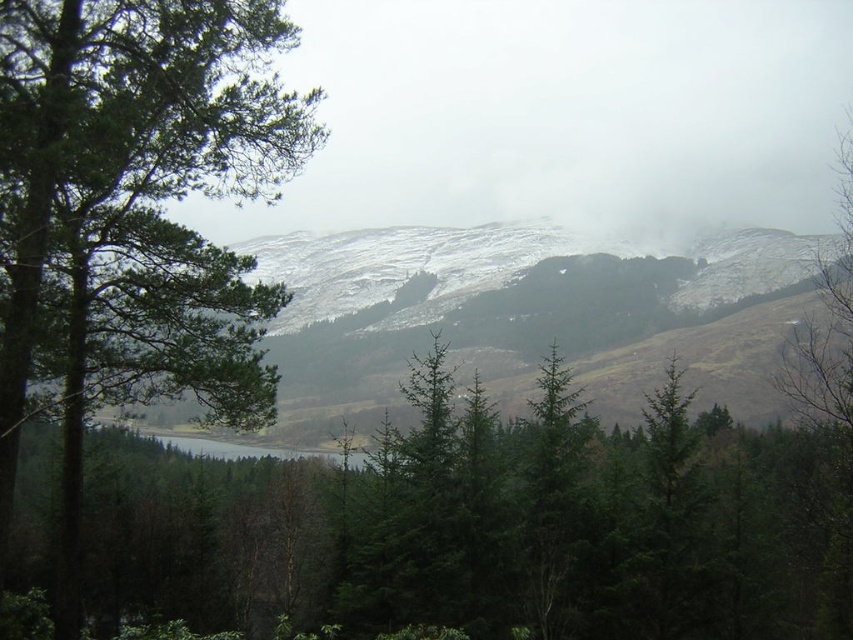
Question: Which object appears farthest from the camera in this image?

Choices:
 (A) green matte tree at left
 (B) green matte forest at center

Answer: (B)

Question: Can you confirm if green matte forest at center is positioned to the left of green matte tree at left?

Choices:
 (A) yes
 (B) no

Answer: (B)

Question: Can you confirm if green matte forest at center is wider than green matte tree at left?

Choices:
 (A) no
 (B) yes

Answer: (B)

Question: In this image, where is green matte forest at center located relative to green matte tree at left?

Choices:
 (A) left
 (B) right

Answer: (B)